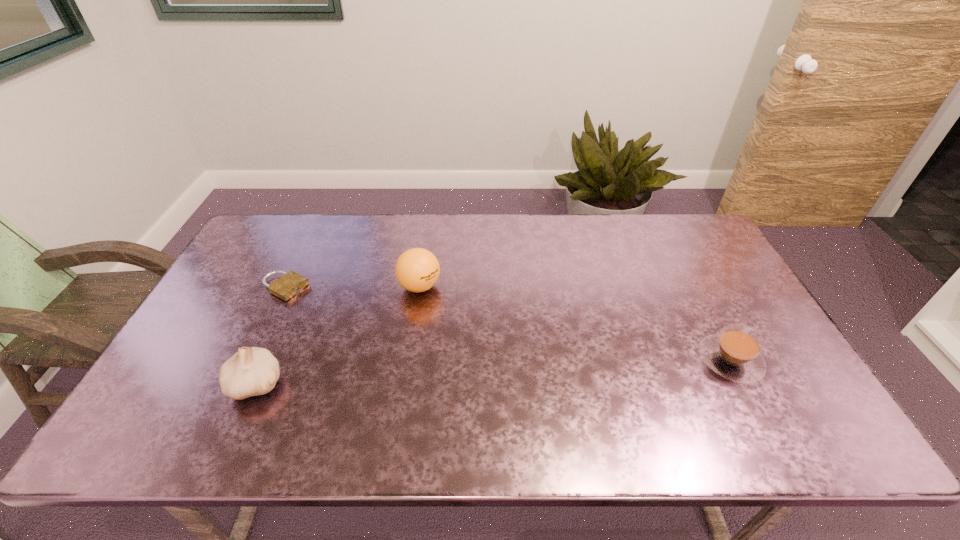
In the image, there is a desktop. In order to click on free region at the right edge in this screenshot , I will do `click(680, 272)`.

Locate an element on the screen. The height and width of the screenshot is (540, 960). free space at the far left corner of the desktop is located at coordinates (296, 217).

Identify the location of vacant space at the far right corner of the desktop. The height and width of the screenshot is (540, 960). (687, 225).

Identify the location of vacant space at the near right corner of the desktop. The image size is (960, 540). (810, 403).

Identify the location of vacant area that lies between the cappuccino and the garlic. The width and height of the screenshot is (960, 540). (493, 372).

Where is `free space between the padlock and the cappuccino`? free space between the padlock and the cappuccino is located at coordinates (508, 324).

I want to click on vacant area that lies between the shortest object and the garlic, so click(271, 336).

Where is `free area in between the padlock and the rightmost object`? free area in between the padlock and the rightmost object is located at coordinates (508, 324).

I want to click on empty space that is in between the second shortest object and the padlock, so click(x=508, y=324).

Identify the location of free space between the third tallest object and the third object from left to right. This screenshot has width=960, height=540. (575, 323).